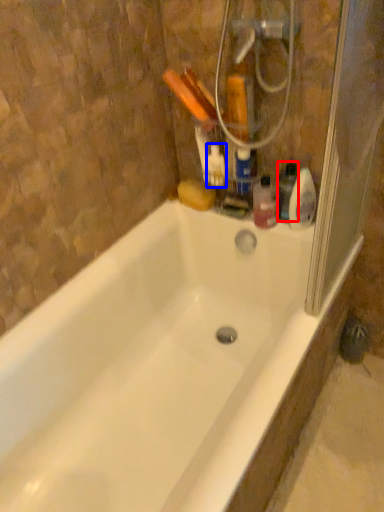
Question: Which of the following is the farthest to the observer, cleaning product (highlighted by a red box) or cleaning product (highlighted by a blue box)?

Choices:
 (A) cleaning product
 (B) cleaning product

Answer: (B)